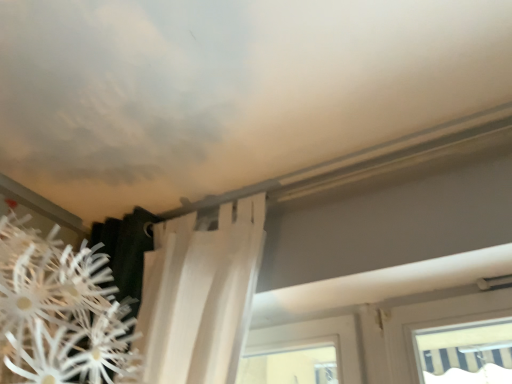
The width and height of the screenshot is (512, 384). Describe the element at coordinates (228, 89) in the screenshot. I see `white matte cloud at upper center` at that location.

What is the approximate width of white matte cloud at upper center?

white matte cloud at upper center is 35.71 inches wide.

At what (x,y) coordinates should I click in order to perform the action: click on white matte cloud at upper center. Please return your answer as a coordinate pair (x, y). The height and width of the screenshot is (384, 512). Looking at the image, I should click on (228, 89).

Identify the location of white matte cloud at upper center. The width and height of the screenshot is (512, 384). (228, 89).